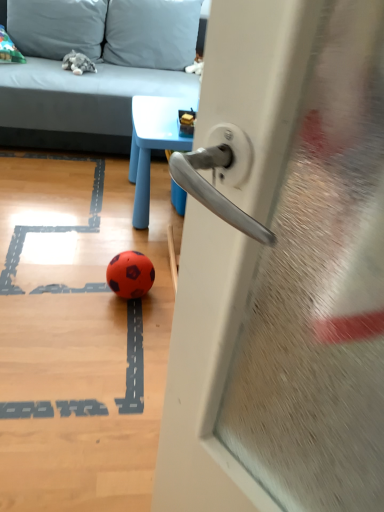
Identify the location of unoccupied region to the right of rubber soccer ball at center. (160, 294).